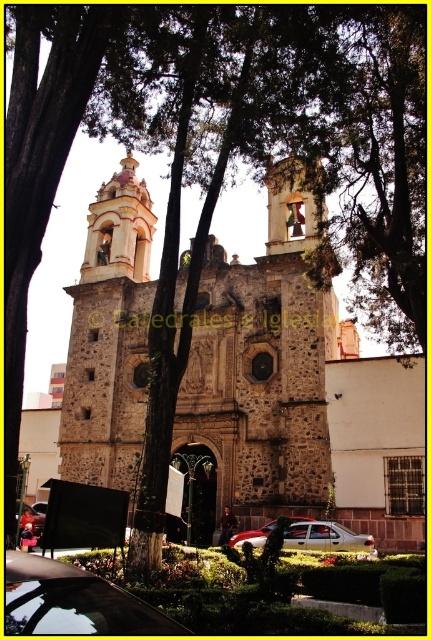
Is stone textured church at center closer to camera compared to metallic silver car at center?

Yes, it is in front of metallic silver car at center.

Describe the element at coordinates (261, 374) in the screenshot. I see `stone textured church at center` at that location.

Between point (61, 424) and point (40, 506), which one is positioned in front?

Point (40, 506) is in front.

This screenshot has height=640, width=431. Find the location of `stone textured church at center`. stone textured church at center is located at coordinates (261, 374).

Is stone textured church at center shorter than red metallic car at center?

In fact, stone textured church at center may be taller than red metallic car at center.

Locate an element on the screen. Image resolution: width=431 pixels, height=640 pixels. stone textured church at center is located at coordinates (261, 374).

What are the coordinates of `stone textured church at center` in the screenshot? It's located at (261, 374).

Does shiny black car at lower left appear on the right side of red metallic car at center?

No, shiny black car at lower left is not to the right of red metallic car at center.

You are a GUI agent. You are given a task and a screenshot of the screen. Output one action in this format:
    pyautogui.click(x=<x>, y=<y>)
    Task: Click on the shiny black car at lower left
    The image size is (431, 640).
    Given the screenshot: What is the action you would take?
    pyautogui.click(x=74, y=602)

Does point (86, 580) lie behind point (306, 518)?

No, it is in front of (306, 518).

Find the location of a particular element. The width and height of the screenshot is (431, 640). shiny black car at lower left is located at coordinates (74, 602).